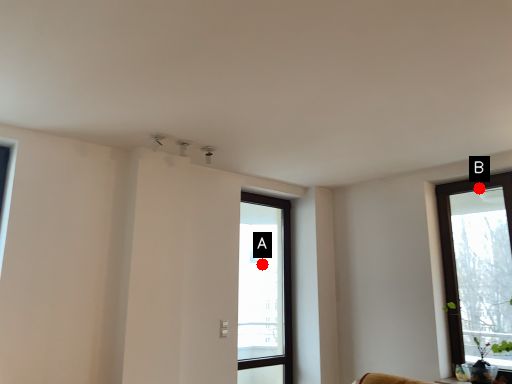
Question: Two points are circled on the image, labeled by A and B beside each circle. Which point is farther from the camera taking this photo?

Choices:
 (A) A is further
 (B) B is further

Answer: (A)